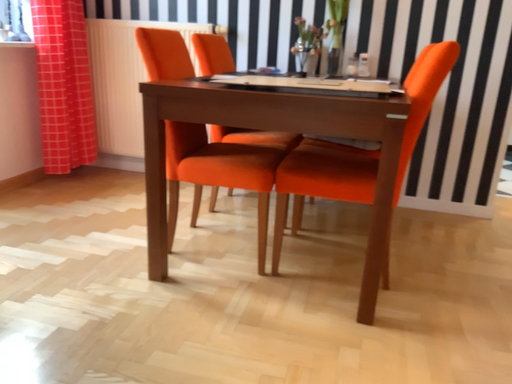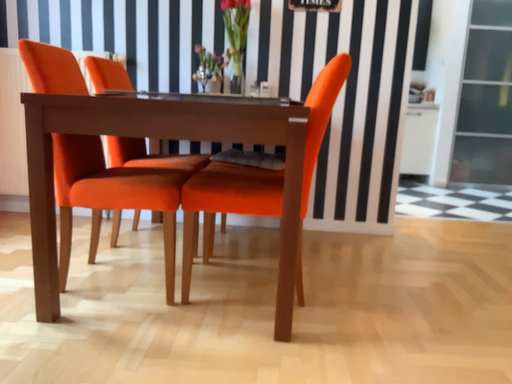
Question: How did the camera likely rotate when shooting the video?

Choices:
 (A) rotated downward
 (B) rotated upward

Answer: (B)